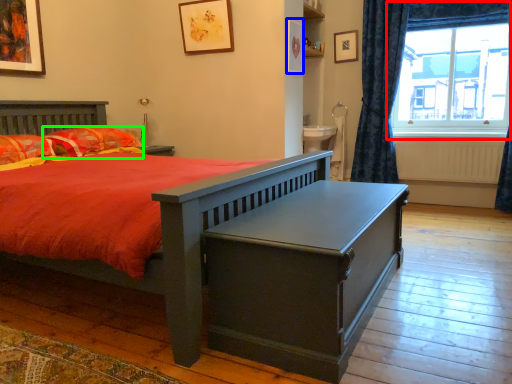
Question: Which is nearer to the window (highlighted by a red box)? picture frame (highlighted by a blue box) or pillow (highlighted by a green box).

Choices:
 (A) picture frame
 (B) pillow

Answer: (A)